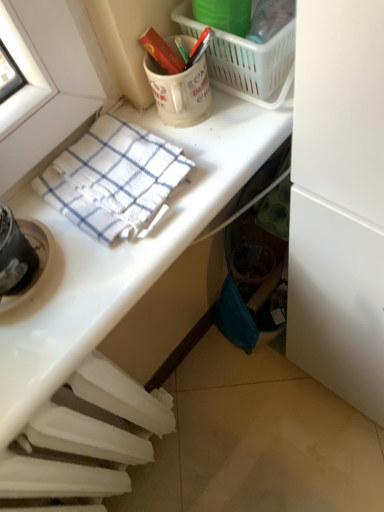
Identify the location of vacant region above white glossy towel at upper left (from a real-world perspective). (127, 199).